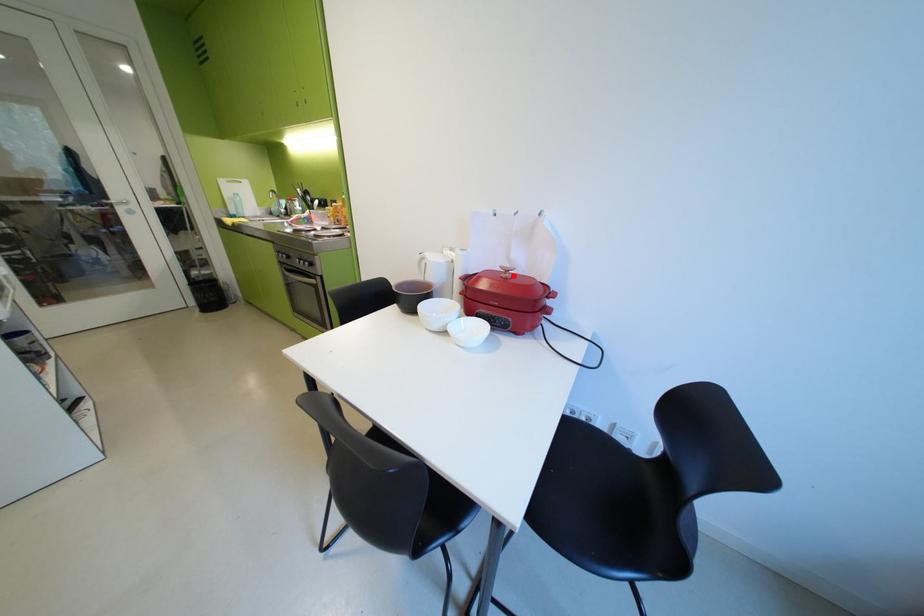
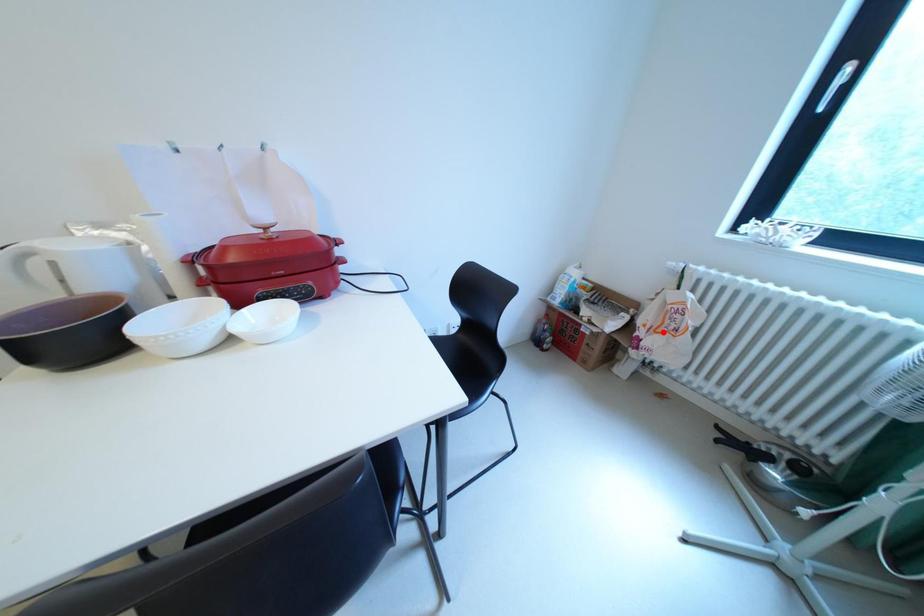
I am providing you with two images of the same scene from different viewpoints. A red point is marked on the first image and another point is marked on the second image. Are the points marked in image1 and image2 representing the same 3D position?

No